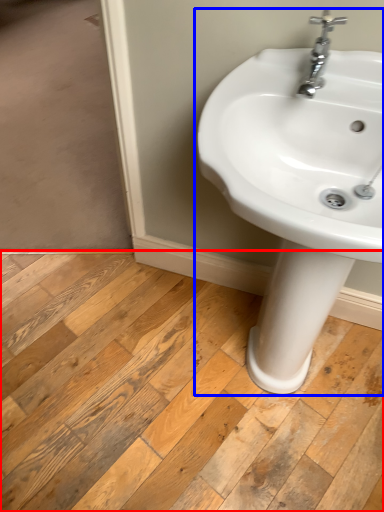
Question: Which point is further to the camera, plank (highlighted by a red box) or sink (highlighted by a blue box)?

Choices:
 (A) plank
 (B) sink

Answer: (A)